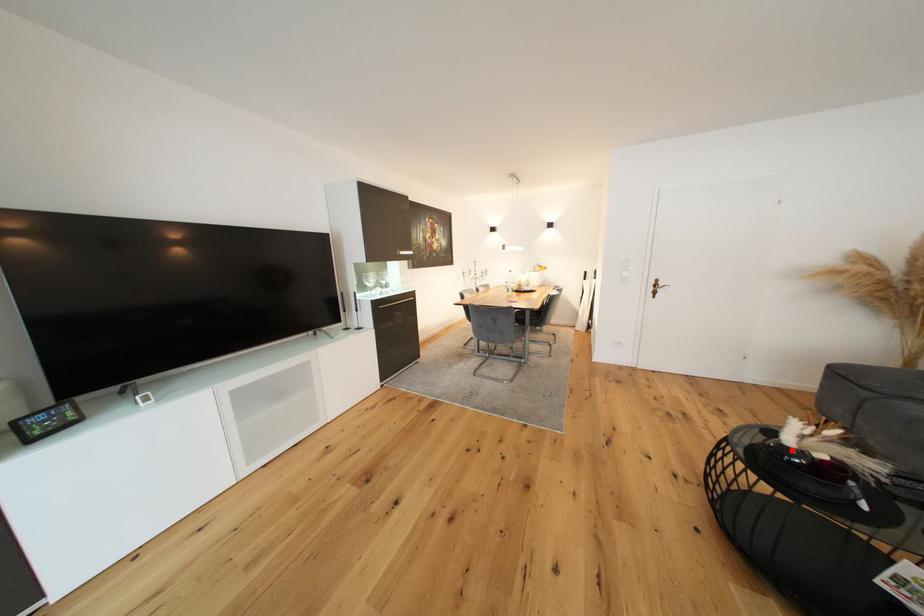
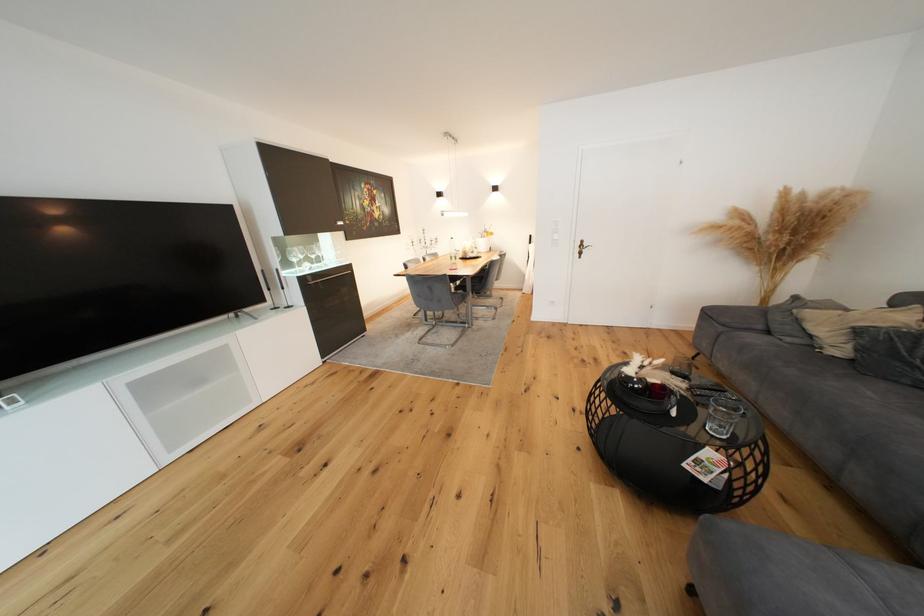
Question: I am providing you with two images of the same scene from different viewpoints. Given a red point in image1, look at the same physical point in image2. Is it:

Choices:
 (A) Closer to the viewpoint
 (B) Farther from the viewpoint

Answer: (A)